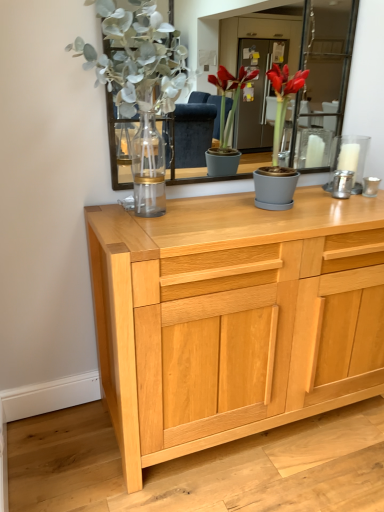
This screenshot has width=384, height=512. Identify the location of vacant area to the right of matte glass vase at upper left. 235,216.